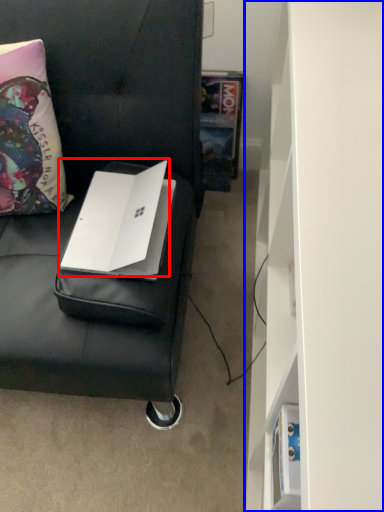
Question: Which point is further to the camera, laptop (highlighted by a red box) or bookshelf (highlighted by a blue box)?

Choices:
 (A) laptop
 (B) bookshelf

Answer: (A)